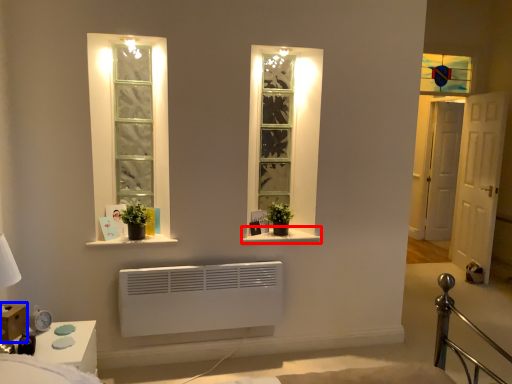
Question: Which object is closer to the camera taking this photo, window sill (highlighted by a red box) or window box (highlighted by a blue box)?

Choices:
 (A) window sill
 (B) window box

Answer: (B)